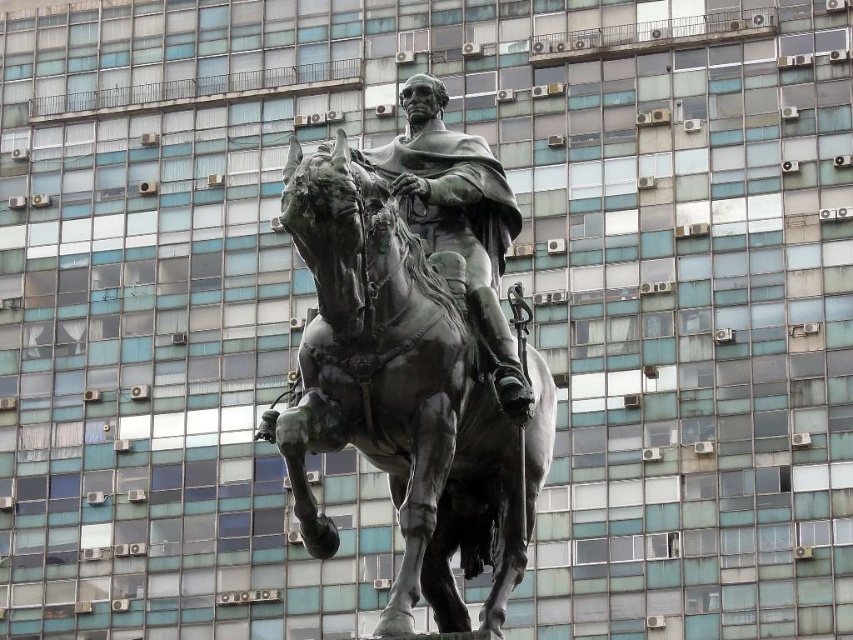
You are standing at the point with coordinates (x=404, y=396) in the scene. What object are you standing on?

You are standing on the bronze golden horse at center.